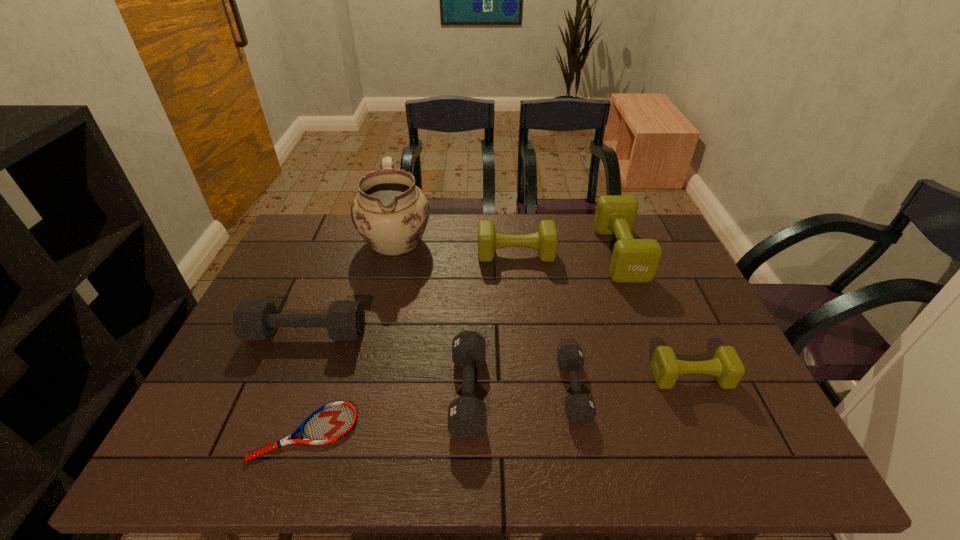
At what (x,y) coordinates should I click in order to perform the action: click on vacant space that satisfies the following two spatial constraints: 1. on the spout of the smallest gray dumbbell; 2. on the left side of the purple pitcher. Please return your answer as a coordinate pair (x, y). This screenshot has height=540, width=960. Looking at the image, I should click on (359, 391).

Identify the location of free space that satisfies the following two spatial constraints: 1. on the back side of the second biggest olive dumbbell; 2. on the right side of the blue tennis racket. The image size is (960, 540). (363, 254).